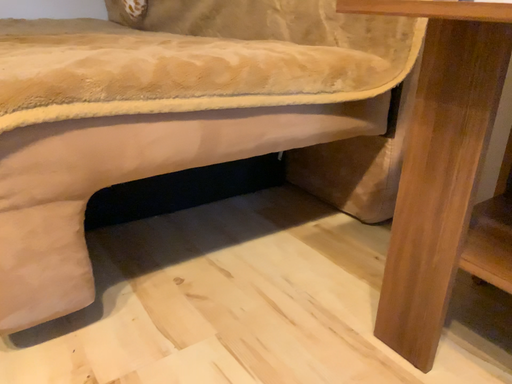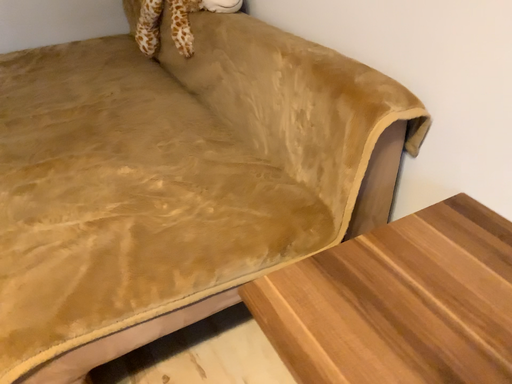
Question: Which way did the camera rotate in the video?

Choices:
 (A) rotated upward
 (B) rotated downward

Answer: (B)